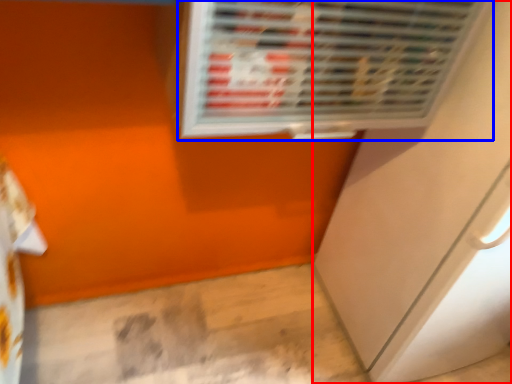
Question: Which of the following is the closest to the observer, screen door (highlighted by a red box) or air conditioning (highlighted by a blue box)?

Choices:
 (A) screen door
 (B) air conditioning

Answer: (B)